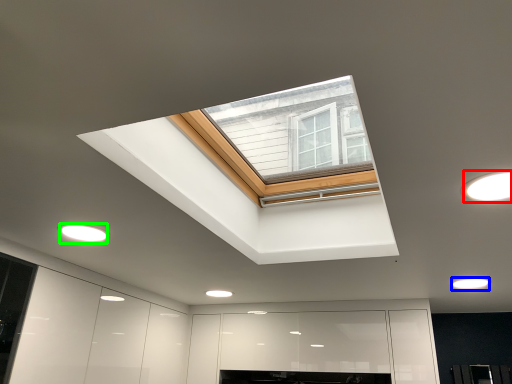
Question: Based on their relative distances, which object is nearer to lighting (highlighted by a red box)? Choose from lighting (highlighted by a blue box) and lighting (highlighted by a green box).

Choices:
 (A) lighting
 (B) lighting

Answer: (A)